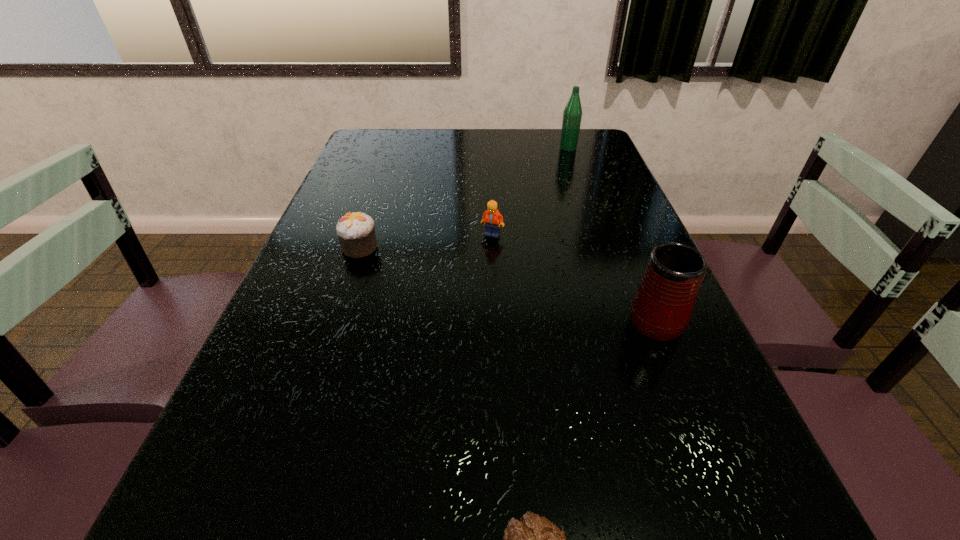
You are a GUI agent. You are given a task and a screenshot of the screen. Output one action in this format:
    pyautogui.click(x=<x>, y=<y>)
    Task: Click on the object that can be found as the third closest to the fourth shortest object
    This screenshot has width=960, height=540.
    Given the screenshot: What is the action you would take?
    pyautogui.click(x=356, y=232)